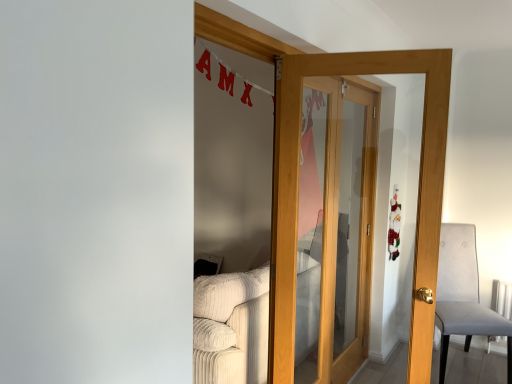
Question: Can beige corduroy couch at lower left be found inside light brown wooden door at center?

Choices:
 (A) yes
 (B) no

Answer: (B)

Question: Is light brown wooden door at center facing towards beige corduroy couch at lower left?

Choices:
 (A) no
 (B) yes

Answer: (A)

Question: Does light brown wooden door at center have a larger size compared to beige corduroy couch at lower left?

Choices:
 (A) no
 (B) yes

Answer: (A)

Question: Is light brown wooden door at center further to camera compared to beige corduroy couch at lower left?

Choices:
 (A) no
 (B) yes

Answer: (A)

Question: Is light brown wooden door at center shorter than beige corduroy couch at lower left?

Choices:
 (A) no
 (B) yes

Answer: (A)

Question: Is point (275, 334) closer or farther from the camera than point (439, 349)?

Choices:
 (A) closer
 (B) farther

Answer: (A)

Question: From a real-world perspective, relative to gray fabric chair at right, is light brown wooden door at center vertically above or below?

Choices:
 (A) above
 (B) below

Answer: (A)

Question: Is light brown wooden door at center in front of or behind gray fabric chair at right in the image?

Choices:
 (A) front
 (B) behind

Answer: (A)

Question: Which is correct: light brown wooden door at center is inside gray fabric chair at right, or outside of it?

Choices:
 (A) outside
 (B) inside

Answer: (A)

Question: In terms of size, does light brown wooden door at center appear bigger or smaller than beige corduroy couch at lower left?

Choices:
 (A) small
 (B) big

Answer: (A)

Question: From their relative heights in the image, would you say light brown wooden door at center is taller or shorter than beige corduroy couch at lower left?

Choices:
 (A) short
 (B) tall

Answer: (B)

Question: In the image, is light brown wooden door at center positioned in front of or behind beige corduroy couch at lower left?

Choices:
 (A) front
 (B) behind

Answer: (A)

Question: Visually, is light brown wooden door at center positioned to the left or to the right of beige corduroy couch at lower left?

Choices:
 (A) left
 (B) right

Answer: (B)

Question: From the image's perspective, is gray fabric chair at right located above or below beige corduroy couch at lower left?

Choices:
 (A) below
 (B) above

Answer: (B)

Question: Is point (503, 327) positioned closer to the camera than point (223, 336)?

Choices:
 (A) farther
 (B) closer

Answer: (A)